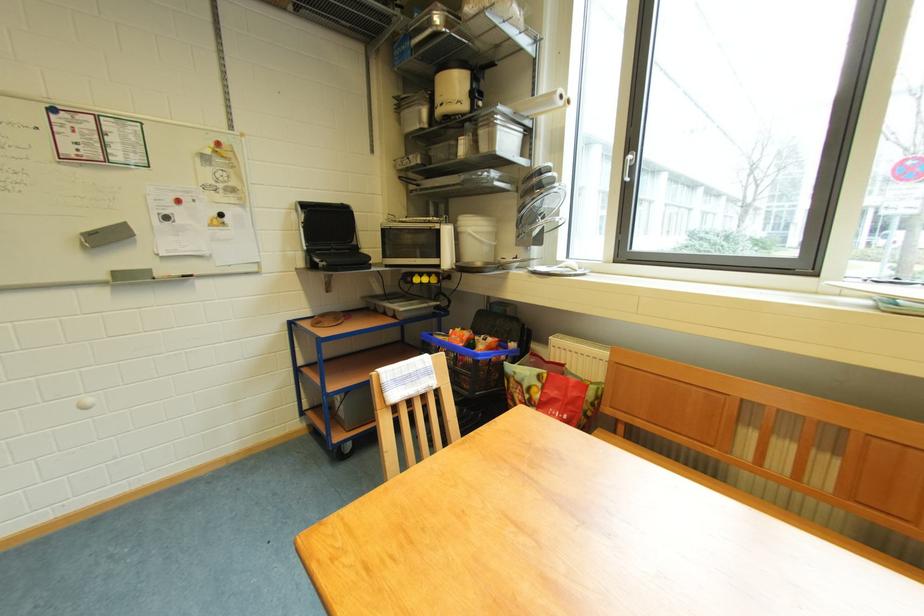
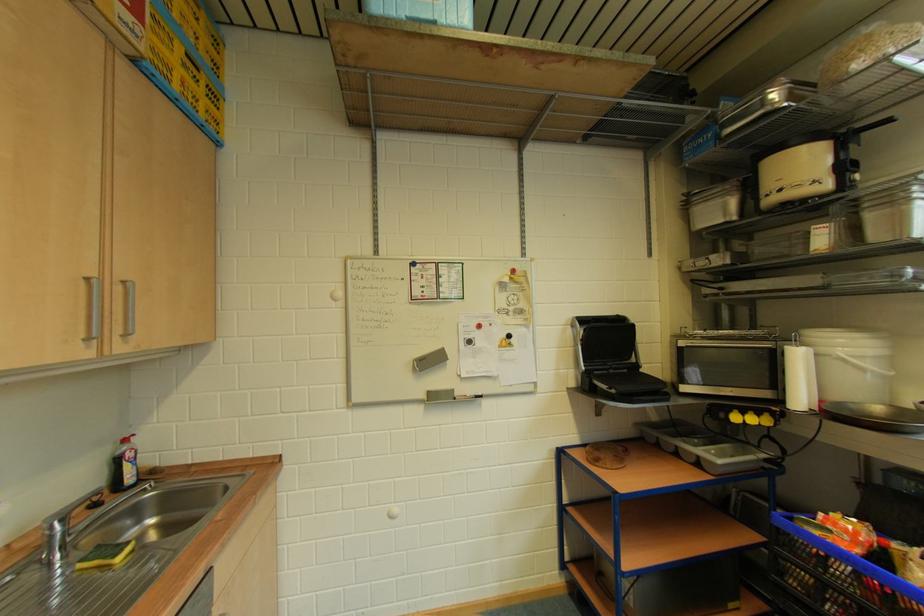
Find the pixel in the second image that matches pixel 390 230 in the first image.

(687, 347)